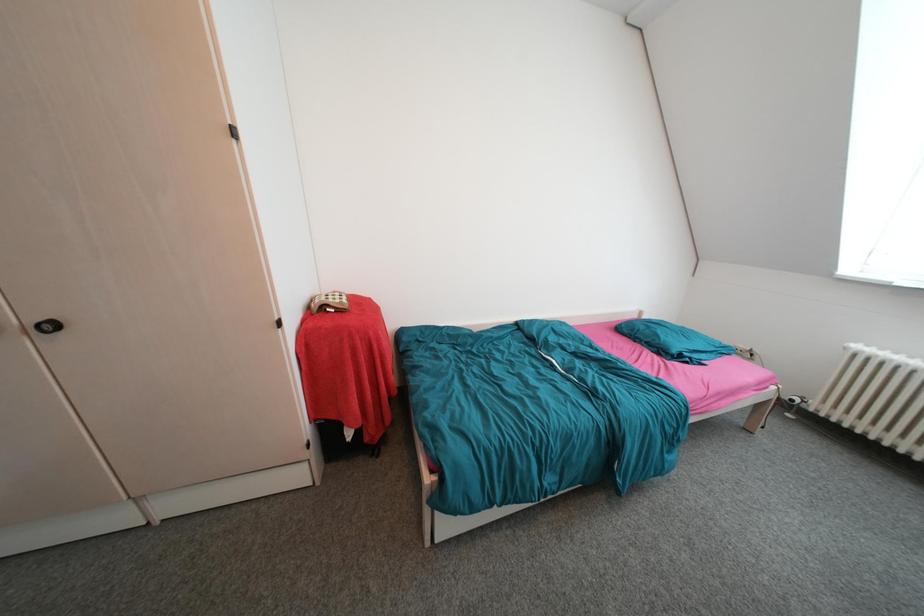
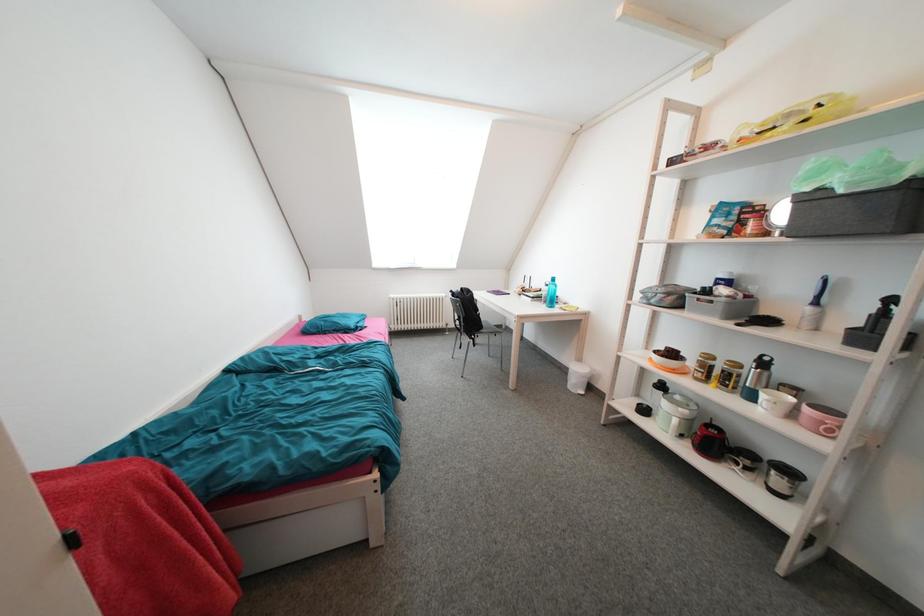
Question: The camera is either moving clockwise (left) or counter-clockwise (right) around the object. The first image is from the beginning of the video and the second image is from the end. Is the camera moving left or right when shooting the video?

Choices:
 (A) Left
 (B) Right

Answer: (A)